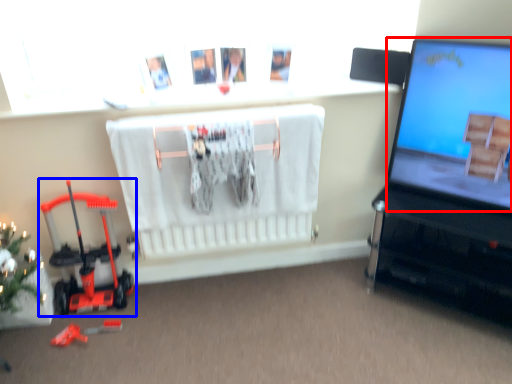
Question: Which object is closer to the camera taking this photo, computer screen (highlighted by a red box) or toy (highlighted by a blue box)?

Choices:
 (A) computer screen
 (B) toy

Answer: (A)